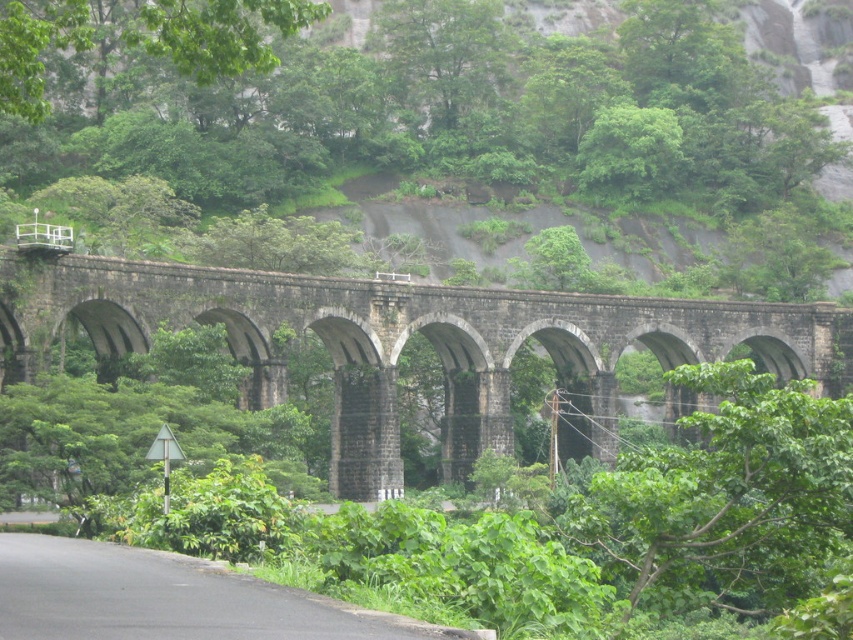
Question: Does dark gray stone bridge at center appear on the right side of green leafy tree at upper center?

Choices:
 (A) no
 (B) yes

Answer: (B)

Question: Considering the relative positions of dark gray stone bridge at center and green leafy tree at upper center in the image provided, where is dark gray stone bridge at center located with respect to green leafy tree at upper center?

Choices:
 (A) right
 (B) left

Answer: (A)

Question: Which of the following is the farthest from the observer?

Choices:
 (A) green leafy tree at upper center
 (B) dark gray stone bridge at center

Answer: (B)

Question: Among these points, which one is farthest from the camera?

Choices:
 (A) (192, 76)
 (B) (668, 390)

Answer: (A)

Question: Can you confirm if dark gray stone bridge at center is positioned to the left of green leafy tree at upper center?

Choices:
 (A) yes
 (B) no

Answer: (B)